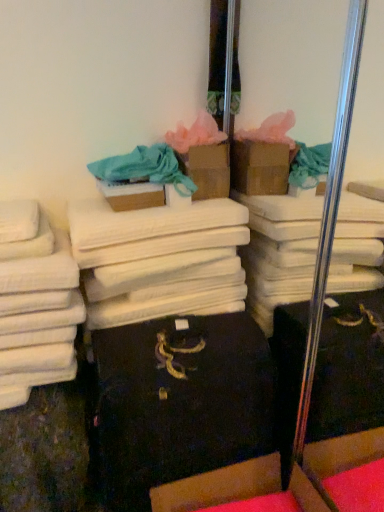
Locate an element on the screen. Image resolution: width=384 pixels, height=512 pixels. cardboard box at center, which is the 3th cardboard box from bottom to top is located at coordinates (208, 170).

This screenshot has height=512, width=384. What do you see at coordinates (208, 170) in the screenshot?
I see `cardboard box at center, which is counted as the 3th cardboard box, starting from the front` at bounding box center [208, 170].

Describe the element at coordinates (144, 169) in the screenshot. I see `matte blue fabric at upper center` at that location.

Find the location of a particular element. white cotton towels at left is located at coordinates (36, 303).

From a real-world perspective, is cardboard box at lower center, acting as the first cardboard box starting from the front, on top of matte blue fabric at upper center?

Incorrect, from a real-world perspective, cardboard box at lower center, acting as the first cardboard box starting from the front, is lower than matte blue fabric at upper center.

From the image's perspective, which one is positioned lower, cardboard box at lower center, acting as the first cardboard box starting from the front, or matte blue fabric at upper center?

cardboard box at lower center, acting as the first cardboard box starting from the front.

How much distance is there between cardboard box at lower center, which ranks as the 3th cardboard box in top-to-bottom order, and matte blue fabric at upper center?

The distance of cardboard box at lower center, which ranks as the 3th cardboard box in top-to-bottom order, from matte blue fabric at upper center is 35.96 inches.

Considering the relative sizes of cardboard box at lower center, which ranks as the 3th cardboard box in top-to-bottom order, and matte blue fabric at upper center in the image provided, is cardboard box at lower center, which ranks as the 3th cardboard box in top-to-bottom order, taller than matte blue fabric at upper center?

Correct, cardboard box at lower center, which ranks as the 3th cardboard box in top-to-bottom order, is much taller as matte blue fabric at upper center.

Is matte blue fabric at upper center oriented away from white cotton towels at center?

No, matte blue fabric at upper center's orientation is not away from white cotton towels at center.

Is matte blue fabric at upper center next to white cotton towels at center and touching it?

No, matte blue fabric at upper center is not touching white cotton towels at center.

Is matte blue fabric at upper center in front of white cotton towels at center?

No, matte blue fabric at upper center is further to the viewer.

Can you tell me how much matte blue fabric at upper center and white cotton towels at center differ in facing direction?

The facing directions of matte blue fabric at upper center and white cotton towels at center are 9.65 degrees apart.

Which object is further away from the camera, matte blue fabric at upper center or cardboard box at center, which is the 3th cardboard box from bottom to top?

cardboard box at center, which is the 3th cardboard box from bottom to top, is more distant.

Which of these two, matte blue fabric at upper center or cardboard box at center, which is the 3th cardboard box from bottom to top, is bigger?

Bigger between the two is matte blue fabric at upper center.

Are matte blue fabric at upper center and cardboard box at center, which is counted as the 3th cardboard box, starting from the front, located far from each other?

No, there isn't a large distance between matte blue fabric at upper center and cardboard box at center, which is counted as the 3th cardboard box, starting from the front.

Could you measure the distance between matte blue fabric at upper center and cardboard box at center, the 1th cardboard box viewed from the back?

matte blue fabric at upper center and cardboard box at center, the 1th cardboard box viewed from the back, are 4.67 inches apart from each other.

From the image's perspective, is cardboard box at lower center, which is counted as the 3th cardboard box, starting from the back, above or below brown cardboard box at center, which appears as the 2th cardboard box when viewed from the back?

Based on their image positions, cardboard box at lower center, which is counted as the 3th cardboard box, starting from the back, is located beneath brown cardboard box at center, which appears as the 2th cardboard box when viewed from the back.

Is cardboard box at lower center, the first cardboard box ordered from the bottom, next to brown cardboard box at center, arranged as the 2th cardboard box when viewed from the front?

No, cardboard box at lower center, the first cardboard box ordered from the bottom, is not next to brown cardboard box at center, arranged as the 2th cardboard box when viewed from the front.

From the image's perspective, which object appears higher, matte blue fabric at upper center or white cotton towels at left?

matte blue fabric at upper center is shown above in the image.

Is matte blue fabric at upper center not within white cotton towels at left?

Yes.

How much distance is there between matte blue fabric at upper center and white cotton towels at left?

A distance of 42.15 centimeters exists between matte blue fabric at upper center and white cotton towels at left.

Who is bigger, matte blue fabric at upper center or white cotton towels at left?

With larger size is matte blue fabric at upper center.

Can you tell me how much cardboard box at center, the 1th cardboard box viewed from the top, and cardboard box at lower center, the first cardboard box ordered from the bottom, differ in facing direction?

cardboard box at center, the 1th cardboard box viewed from the top, and cardboard box at lower center, the first cardboard box ordered from the bottom, are facing 91.5 degrees away from each other.

Identify the location of cardboard box that is the 2nd object located above the cardboard box at lower center, the first cardboard box ordered from the bottom (from the image's perspective). This screenshot has height=512, width=384. pyautogui.click(x=208, y=170).

Which of these two, cardboard box at center, the 1th cardboard box viewed from the top, or cardboard box at lower center, which ranks as the 3th cardboard box in top-to-bottom order, is bigger?

Bigger between the two is cardboard box at lower center, which ranks as the 3th cardboard box in top-to-bottom order.

Is point (220, 172) positioned after point (303, 462)?

Yes.

From the image's perspective, is white cotton towels at left above cardboard box at center, the 1th cardboard box viewed from the back?

Result: No, from the image's perspective, white cotton towels at left is not above cardboard box at center, the 1th cardboard box viewed from the back.

Is white cotton towels at left facing towards cardboard box at center, the 1th cardboard box viewed from the back?

No, white cotton towels at left is not aimed at cardboard box at center, the 1th cardboard box viewed from the back.

Would you say white cotton towels at left is inside or outside cardboard box at center, which is the 3th cardboard box from bottom to top?

white cotton towels at left exists outside the volume of cardboard box at center, which is the 3th cardboard box from bottom to top.

In the scene shown: Is the position of white cotton towels at left more distant than that of cardboard box at center, the 1th cardboard box viewed from the back?

No, it is not.

The height and width of the screenshot is (512, 384). Find the location of `clothing above the cardboard box at lower center, which ranks as the 3th cardboard box in top-to-bottom order (from a real-world perspective)`. clothing above the cardboard box at lower center, which ranks as the 3th cardboard box in top-to-bottom order (from a real-world perspective) is located at coordinates (144, 169).

Identify the location of clothing located on the left of white cotton towels at center. This screenshot has width=384, height=512. (144, 169).

From the image, which object appears to be farther from cardboard box at center, which is the 3th cardboard box from bottom to top, brown cardboard box at center, which appears as the 2th cardboard box when viewed from the back, or matte blue fabric at upper center?

brown cardboard box at center, which appears as the 2th cardboard box when viewed from the back, is positioned further to the anchor cardboard box at center, which is the 3th cardboard box from bottom to top.

Based on their spatial positions, is white cotton towels at center or white cotton towels at left further from brown cardboard box at center, arranged as the 2th cardboard box when viewed from the front?

The object further to brown cardboard box at center, arranged as the 2th cardboard box when viewed from the front, is white cotton towels at left.

From the image, which object appears to be farther from matte blue fabric at upper center, white cotton towels at left or white cotton towels at center?

white cotton towels at left is positioned further to the anchor matte blue fabric at upper center.

Consider the image. When comparing their distances from white cotton towels at left, does cardboard box at lower center, acting as the first cardboard box starting from the front, or cardboard box at center, which is counted as the 3th cardboard box, starting from the front, seem further?

cardboard box at center, which is counted as the 3th cardboard box, starting from the front, is positioned further to the anchor white cotton towels at left.

From the image, which object appears to be nearer to brown cardboard box at center, which appears as the 2th cardboard box when viewed from the back, matte blue fabric at upper center or white cotton towels at left?

matte blue fabric at upper center lies closer to brown cardboard box at center, which appears as the 2th cardboard box when viewed from the back, than the other object.

From the image, which object appears to be nearer to white cotton towels at left, matte blue fabric at upper center or cardboard box at center, which is the 3th cardboard box from bottom to top?

matte blue fabric at upper center.

Looking at the image, which one is located closer to cardboard box at lower center, which ranks as the 3th cardboard box in top-to-bottom order, white cotton towels at center or white cotton towels at left?

Based on the image, white cotton towels at center appears to be nearer to cardboard box at lower center, which ranks as the 3th cardboard box in top-to-bottom order.

Estimate the real-world distances between objects in this image. Which object is further from white cotton towels at left, cardboard box at center, the 1th cardboard box viewed from the back, or brown cardboard box at center, arranged as the 2th cardboard box when viewed from the front?

cardboard box at center, the 1th cardboard box viewed from the back, lies further to white cotton towels at left than the other object.

This screenshot has height=512, width=384. Identify the location of bath towel between brown cardboard box at center, which ranks as the second cardboard box in top-to-bottom order, and cardboard box at lower center, which is counted as the 3th cardboard box, starting from the back, vertically. (161, 260).

At what (x,y) coordinates should I click in order to perform the action: click on material that lies between cardboard box at center, which is counted as the 3th cardboard box, starting from the front, and cardboard box at lower center, which ranks as the 3th cardboard box in top-to-bottom order, from top to bottom. Please return your answer as a coordinate pair (x, y). Looking at the image, I should click on (36, 303).

This screenshot has width=384, height=512. Identify the location of clothing that lies between cardboard box at center, the 1th cardboard box viewed from the back, and cardboard box at lower center, which is counted as the 3th cardboard box, starting from the back, from top to bottom. (144, 169).

You are a GUI agent. You are given a task and a screenshot of the screen. Output one action in this format:
    pyautogui.click(x=<x>, y=<y>)
    Task: Click on the material between matte blue fabric at upper center and cardboard box at lower center, which ranks as the 3th cardboard box in top-to-bottom order, in the up-down direction
    The image size is (384, 512).
    Given the screenshot: What is the action you would take?
    pyautogui.click(x=36, y=303)